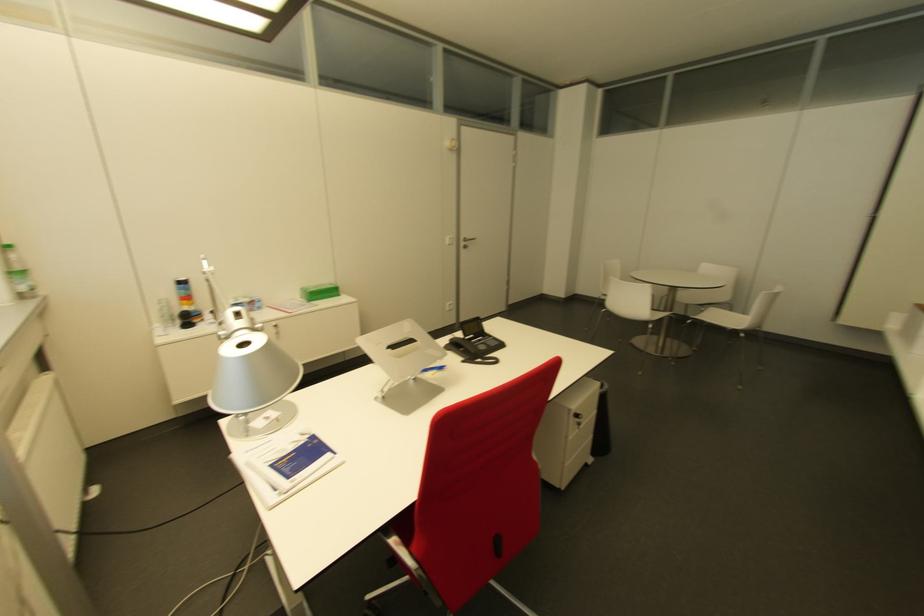
The width and height of the screenshot is (924, 616). Describe the element at coordinates (580, 418) in the screenshot. I see `the cabinet lock` at that location.